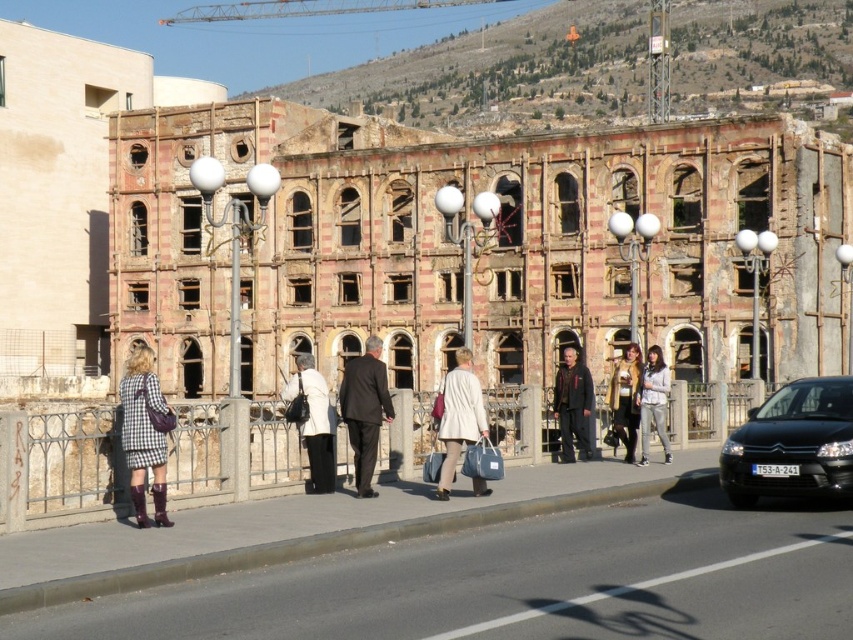
You are a pedestrian trying to cross the sidewalk. You see a black matte car at right and a light beige coat at center. Which object is nearer to you?

A: The black matte car at right is closer to the viewer than the light beige coat at center.

You are a photographer standing on the sidewalk and want to take a photo of the dark brown suit at center and the white matte coat at center. Which one will appear larger in the photo?

The dark brown suit at center will appear larger in the photo because it is closer to the viewer than the white matte coat at center.

You are a pedestrian trying to cross the sidewalk where the black matte car at right and the yellow textured scarf at center are located. Which object is wider so you can choose a path around it?

The black matte car at right is wider than the yellow textured scarf at center, so you should choose a path around the black matte car at right.